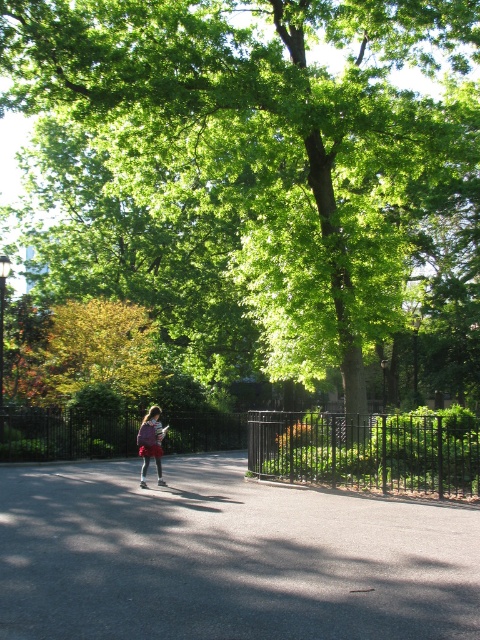
Which of these two, smooth asphalt path at center or black rubber skate at center, stands shorter?

black rubber skate at center

Between smooth asphalt path at center and black rubber skate at center, which one has more height?

smooth asphalt path at center is taller.

Is point (247, 576) positioned after point (160, 481)?

No, it is not.

Locate an element on the screen. smooth asphalt path at center is located at coordinates (227, 556).

Who is more distant from viewer, [418,490] or [237,424]?

The point [237,424] is more distant.

Based on the photo, does black metal fence at lower center come behind black metal fence at center?

No.

Which is behind, point (364, 461) or point (189, 420)?

The point (189, 420) is more distant.

This screenshot has width=480, height=640. I want to click on black metal fence at lower center, so click(368, 451).

Who is lower down, smooth asphalt path at center or matte purple backpack at center?

smooth asphalt path at center

Does smooth asphalt path at center appear on the left side of matte purple backpack at center?

No, smooth asphalt path at center is not to the left of matte purple backpack at center.

This screenshot has width=480, height=640. What are the coordinates of `smooth asphalt path at center` in the screenshot? It's located at [227, 556].

At what (x,y) coordinates should I click in order to perform the action: click on smooth asphalt path at center. Please return your answer as a coordinate pair (x, y). Looking at the image, I should click on pos(227,556).